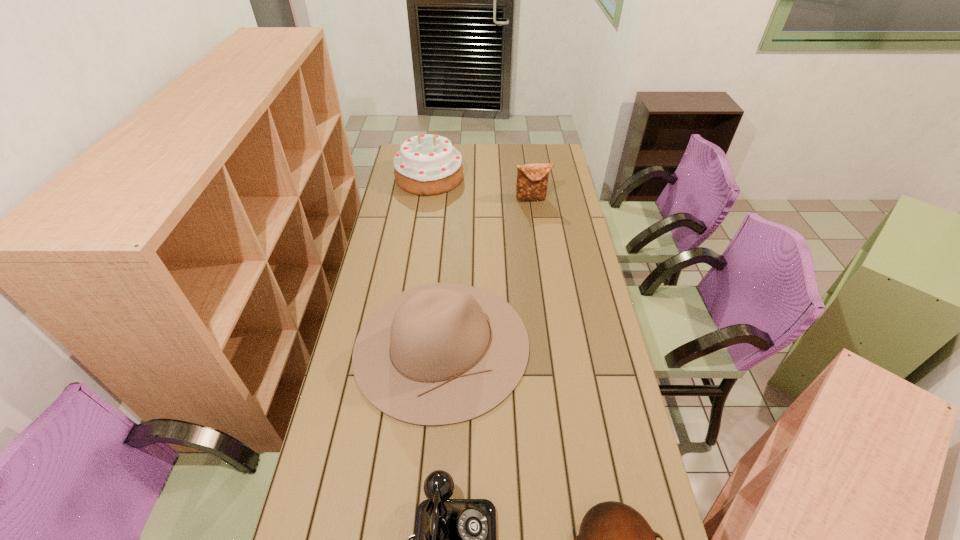
Locate an element on the screen. Image resolution: width=960 pixels, height=540 pixels. object located at the far left corner is located at coordinates (427, 164).

In the image, there is a desktop. At what (x,y) coordinates should I click in order to perform the action: click on free region at the far edge. Please return your answer as a coordinate pair (x, y). Looking at the image, I should click on click(x=507, y=155).

Where is `vacant space at the left edge`? vacant space at the left edge is located at coordinates (339, 402).

In the image, there is a desktop. Where is `vacant space at the right edge`? The height and width of the screenshot is (540, 960). vacant space at the right edge is located at coordinates (573, 300).

This screenshot has height=540, width=960. Find the location of `vacant area that lies between the cake and the third shortest object`. vacant area that lies between the cake and the third shortest object is located at coordinates 481,188.

Identify the location of free space between the cake and the third farthest object. (436, 261).

Find the location of a particular element. vacant space in between the sombrero and the cake is located at coordinates (436, 261).

Where is `vacant space that's between the third tallest object and the cake`? vacant space that's between the third tallest object and the cake is located at coordinates (481, 188).

Where is `free area in between the third farthest object and the clutch bag`? The height and width of the screenshot is (540, 960). free area in between the third farthest object and the clutch bag is located at coordinates (487, 272).

Where is `free spot between the cake and the third shortest object`? The width and height of the screenshot is (960, 540). free spot between the cake and the third shortest object is located at coordinates (481, 188).